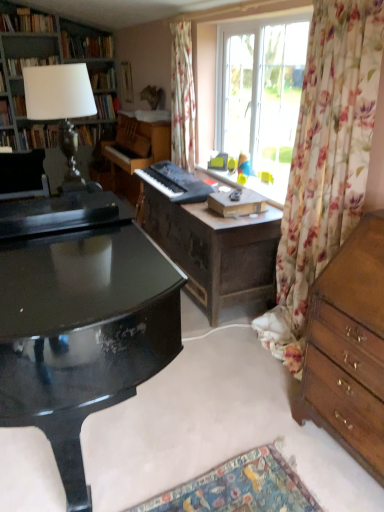
Question: Is wooden chest of drawers at right not within wooden piano at center, acting as the first piano starting from the back?

Choices:
 (A) yes
 (B) no

Answer: (A)

Question: Is wooden chest of drawers at right touching wooden piano at center, acting as the first piano starting from the back?

Choices:
 (A) no
 (B) yes

Answer: (A)

Question: Is wooden chest of drawers at right behind wooden piano at center, the second piano from the front?

Choices:
 (A) no
 (B) yes

Answer: (A)

Question: Does wooden chest of drawers at right have a lesser height compared to wooden piano at center, the second piano from the front?

Choices:
 (A) no
 (B) yes

Answer: (A)

Question: Considering the relative positions of wooden chest of drawers at right and wooden piano at center, the second piano from the front, in the image provided, is wooden chest of drawers at right to the left of wooden piano at center, the second piano from the front, from the viewer's perspective?

Choices:
 (A) yes
 (B) no

Answer: (B)

Question: Is wooden chest of drawers at right not close to wooden piano at center, acting as the first piano starting from the back?

Choices:
 (A) yes
 (B) no

Answer: (A)

Question: Is wooden chest of drawers at right thinner than floral fabric curtain at right, which is the 1th curtain in front-to-back order?

Choices:
 (A) yes
 (B) no

Answer: (B)

Question: From a real-world perspective, is wooden chest of drawers at right over floral fabric curtain at right, which is the 1th curtain in front-to-back order?

Choices:
 (A) yes
 (B) no

Answer: (B)

Question: Could you tell me if wooden chest of drawers at right is facing floral fabric curtain at right, placed as the 2th curtain when sorted from left to right?

Choices:
 (A) no
 (B) yes

Answer: (A)

Question: Is wooden chest of drawers at right wider than floral fabric curtain at right, the 2th curtain when ordered from back to front?

Choices:
 (A) yes
 (B) no

Answer: (A)

Question: Is wooden chest of drawers at right at the left side of floral fabric curtain at right, placed as the 2th curtain when sorted from left to right?

Choices:
 (A) yes
 (B) no

Answer: (B)

Question: Can we say wooden chest of drawers at right lies outside floral fabric curtain at right, positioned as the first curtain in right-to-left order?

Choices:
 (A) no
 (B) yes

Answer: (B)

Question: From a real-world perspective, is white fabric lampshade at upper left physically above matte black lampshade at upper left, marked as the 4th book in a top-to-bottom arrangement?

Choices:
 (A) yes
 (B) no

Answer: (B)